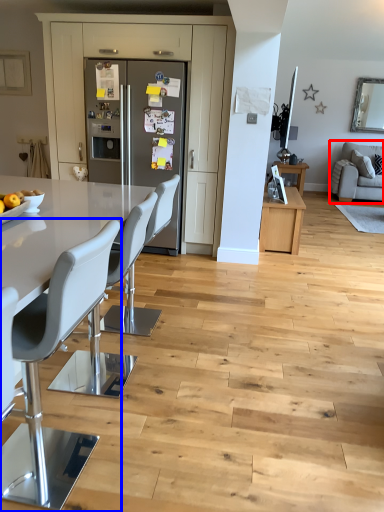
Question: Which of the following is the closest to the observer, studio couch (highlighted by a red box) or chair (highlighted by a blue box)?

Choices:
 (A) studio couch
 (B) chair

Answer: (B)